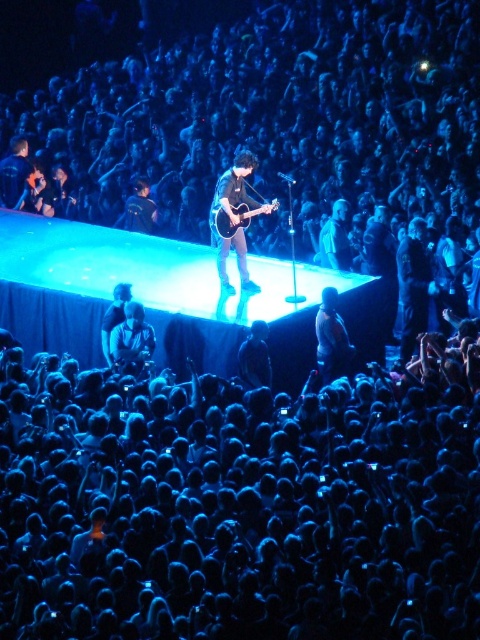
Which of these two, shiny black guitar at center or glossy wood guitar at center, stands shorter?

Standing shorter between the two is glossy wood guitar at center.

Who is positioned more to the right, shiny black guitar at center or glossy wood guitar at center?

glossy wood guitar at center

Which is in front, point (228, 204) or point (247, 209)?

Point (228, 204) is more forward.

Locate an element on the screen. The image size is (480, 640). shiny black guitar at center is located at coordinates (235, 220).

Who is positioned more to the right, dark blue fabric at lower right or shiny silver guitar at center?

dark blue fabric at lower right is more to the right.

Is point (316, 312) in front of point (133, 305)?

That is False.

This screenshot has height=640, width=480. I want to click on dark blue fabric at lower right, so click(x=332, y=339).

Does shiny black guitar at center appear over shiny silver guitar at center?

Yes, shiny black guitar at center is above shiny silver guitar at center.

Is point (229, 244) positioned after point (117, 364)?

That is True.

Which is in front, point (239, 273) or point (126, 353)?

Positioned in front is point (126, 353).

Image resolution: width=480 pixels, height=640 pixels. In order to click on shiny black guitar at center in this screenshot , I will do `click(235, 220)`.